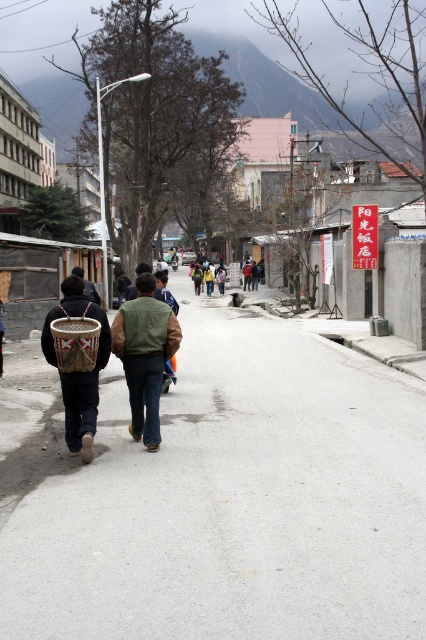
You are a hiker planning to walk along the path between point (141, 381) and point (94, 401). Which point is closer to you as you start walking?

Point (141, 381) is closer to you than point (94, 401) because it is further to the viewer, meaning it is physically nearer in the scene.

You are standing at the point labeled point (63,364) and want to walk to the point labeled point (308,332). Given that the road is 2 meters wide, will you be able to walk directly to your destination without crossing the road?

Point (308,332) is behind point (63,364), so you can walk directly to your destination without crossing the road since they are along the same path.

You are a traveler on the road and see the green suede vest at center and the brown woven basket at left. Which item is positioned to the right of the other?

The green suede vest at center is positioned to the right of the brown woven basket at left.